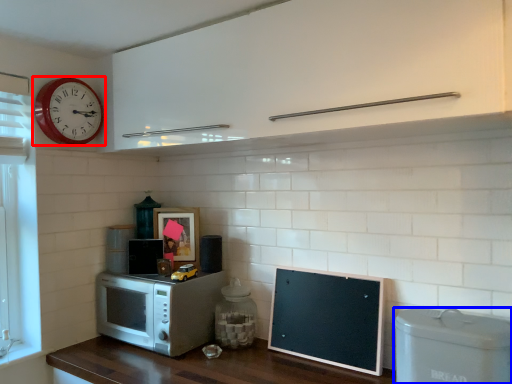
Question: Which object appears farthest to the camera in this image, wall clock (highlighted by a red box) or appliance (highlighted by a blue box)?

Choices:
 (A) wall clock
 (B) appliance

Answer: (A)